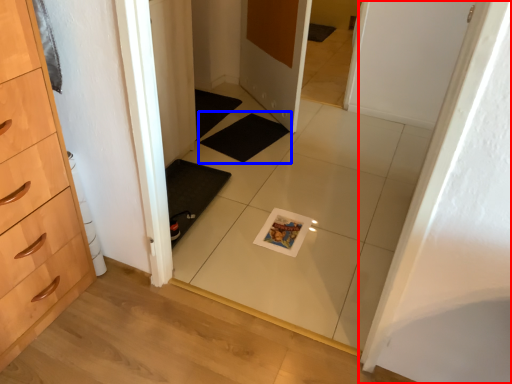
Question: Which of the following is the closest to the observer, door (highlighted by a red box) or bath mat (highlighted by a blue box)?

Choices:
 (A) door
 (B) bath mat

Answer: (A)